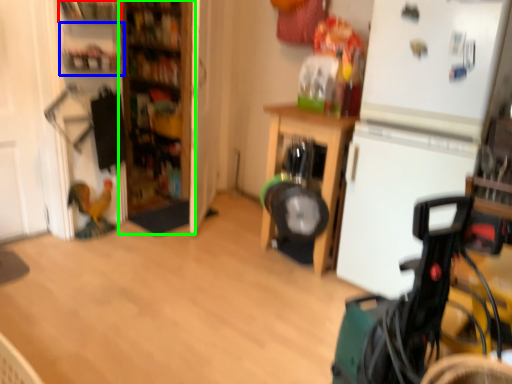
Question: Estimate the real-world distances between objects in this image. Which object is farther from shelf (highlighted by a red box), shelf (highlighted by a blue box) or bookshelf (highlighted by a green box)?

Choices:
 (A) shelf
 (B) bookshelf

Answer: (B)